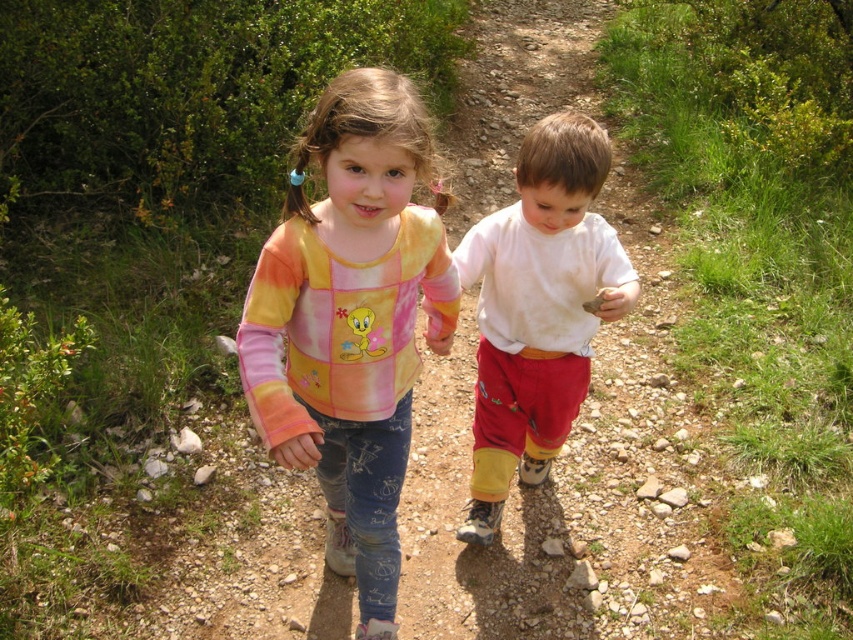
The dirt track at center and the white cotton shirt at center are both located at the center of the image. Which one has a smaller width?

The dirt track at center is thinner than the white cotton shirt at center, so the dirt track at center has a smaller width.